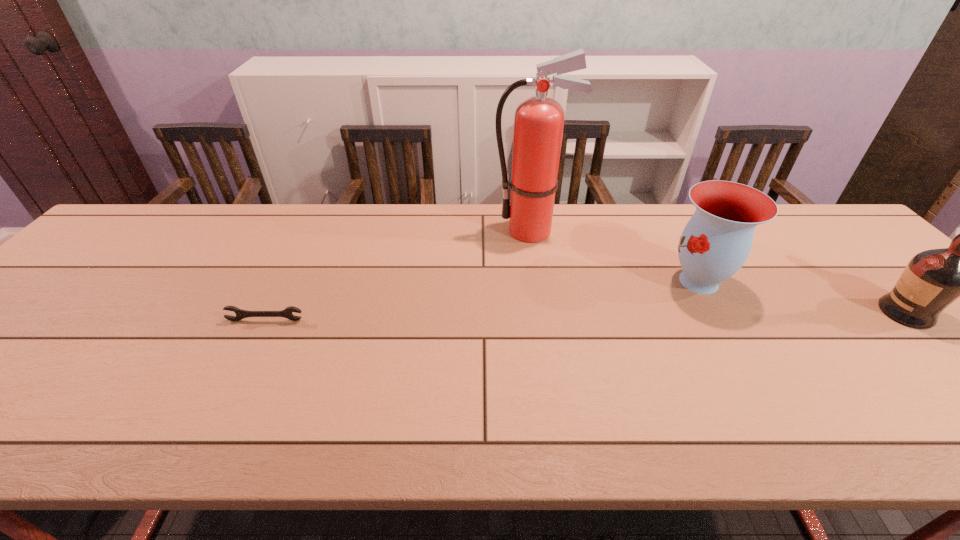
This screenshot has width=960, height=540. In the image, there is a desktop. Find the location of `vacant region at the left edge`. vacant region at the left edge is located at coordinates (79, 313).

Image resolution: width=960 pixels, height=540 pixels. In the image, there is a desktop. What are the coordinates of `vacant space at the right edge` in the screenshot? It's located at (859, 278).

You are a GUI agent. You are given a task and a screenshot of the screen. Output one action in this format:
    pyautogui.click(x=<x>, y=<y>)
    Task: Click on the free spot at the far right corner of the desktop
    
    Given the screenshot: What is the action you would take?
    pyautogui.click(x=864, y=245)

Find the location of a particular element. The width and height of the screenshot is (960, 540). unoccupied position between the farthest object and the vase is located at coordinates (615, 256).

Find the location of a particular element. The image size is (960, 540). free space between the farthest object and the second object from right to left is located at coordinates (615, 256).

Identify the location of empty space that is in between the vase and the rightmost object. The image size is (960, 540). (803, 297).

This screenshot has width=960, height=540. Identify the location of vacant area that lies between the third object from left to right and the leftmost object. (482, 301).

Where is `vacant space that's between the leftmost object and the third object from left to right`? The width and height of the screenshot is (960, 540). vacant space that's between the leftmost object and the third object from left to right is located at coordinates (482, 301).

This screenshot has width=960, height=540. Find the location of `empty space that is in between the farthest object and the shortest object`. empty space that is in between the farthest object and the shortest object is located at coordinates (398, 275).

Identify the location of vacant area between the wrench and the rightmost object. (586, 316).